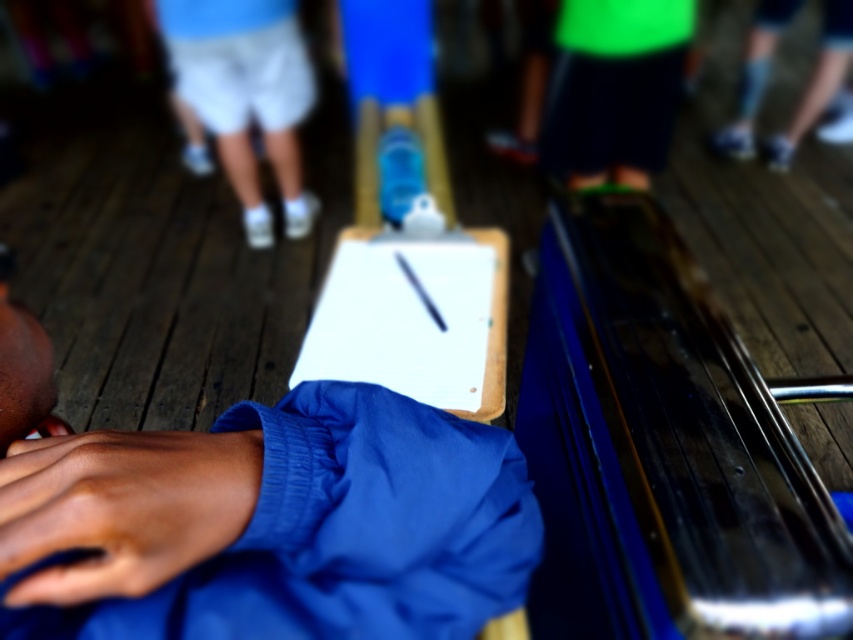
Question: Can you confirm if blue fabric shirt at center is positioned to the left of white paperboard at center?

Choices:
 (A) no
 (B) yes

Answer: (B)

Question: Which point is farther from the camera taking this photo?

Choices:
 (A) (169, 529)
 (B) (346, 349)

Answer: (B)

Question: Where is dark skin hand at lower left located in relation to white cotton shorts at upper center in the image?

Choices:
 (A) above
 (B) below

Answer: (B)

Question: Which of the following is the farthest from the observer?

Choices:
 (A) (183, 525)
 (B) (355, 253)
 (C) (335, 621)

Answer: (B)

Question: Is the position of dark skin hand at lower left less distant than that of white paperboard at center?

Choices:
 (A) no
 (B) yes

Answer: (B)

Question: Which object is the closest to the white cotton shorts at upper center?

Choices:
 (A) blue fabric shirt at center
 (B) white paperboard at center

Answer: (B)